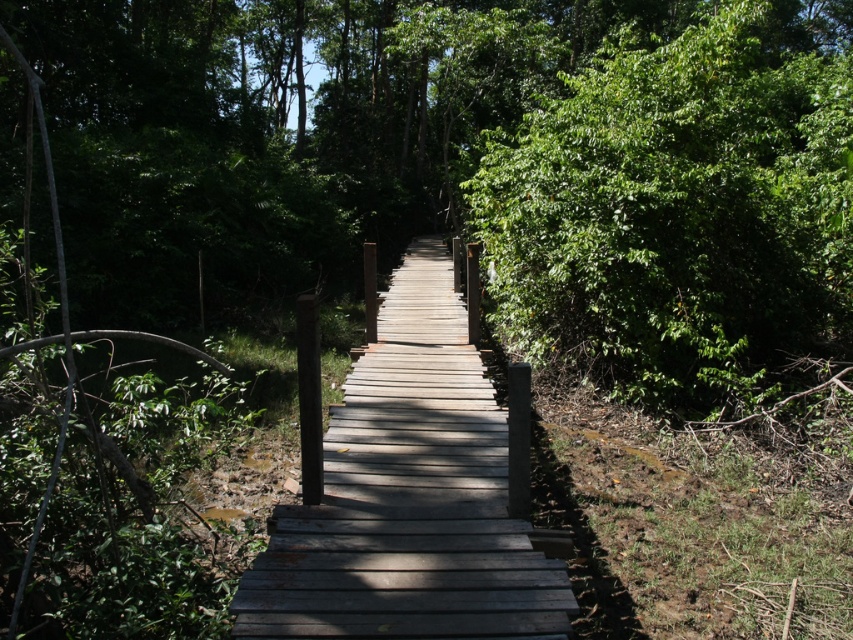
You are standing on the wooden boardwalk and want to walk towards the gray wooden bridge at center. There is a green leafy bush at right in your path. Which object will you encounter first?

You will encounter the green leafy bush at right first because it is closer to you than the gray wooden bridge at center.

You are standing at the starting point of the boardwalk and want to reach the green leafy bush at right. According to the coordinates provided, in which direction should you walk along the boardwalk to reach it?

The green leafy bush at right is located at coordinates point (680,209). Since the boardwalk extends into the forest, you should walk forward along the boardwalk towards the direction where the coordinates increase to reach the green leafy bush at right.

You are standing on the gray wooden bridge at center and looking towards the green leafy bush at right. Is the bush above or below the bridge?

The green leafy bush at right is located above the gray wooden bridge at center, so the bush is above the bridge.